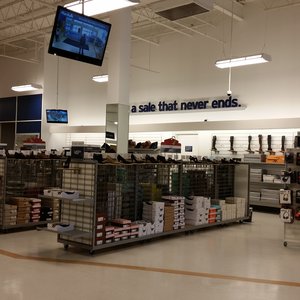
Where is `tile floor`? tile floor is located at coordinates (223, 243).